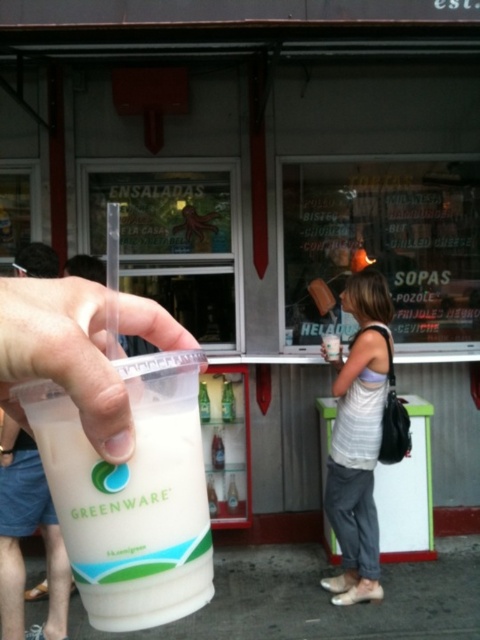
Can you confirm if white translucent plastic cup at center-left is thinner than clear plastic cup at center?

In fact, white translucent plastic cup at center-left might be wider than clear plastic cup at center.

Who is more distant from viewer, (x=87, y=429) or (x=228, y=403)?

The point (x=228, y=403) is more distant.

Between point (9, 323) and point (228, 396), which one is positioned behind?

The point (228, 396) is behind.

The width and height of the screenshot is (480, 640). Identify the location of white translucent plastic cup at center-left. (78, 349).

Is point (88, 308) positioned in front of point (335, 429)?

Yes, it is in front of point (335, 429).

Between white translucent plastic cup at center-left and white striped tank top at center, which one has more height?

white striped tank top at center is taller.

This screenshot has height=640, width=480. Identify the location of white translucent plastic cup at center-left. (78, 349).

Does point (344, 465) come behind point (200, 381)?

Yes, it is.

Can you confirm if white striped tank top at center is positioned below translucent plastic cup at center?

Yes, white striped tank top at center is below translucent plastic cup at center.

Is point (372, 388) positioned before point (207, 417)?

Yes, point (372, 388) is in front of point (207, 417).

I want to click on white striped tank top at center, so click(x=359, y=438).